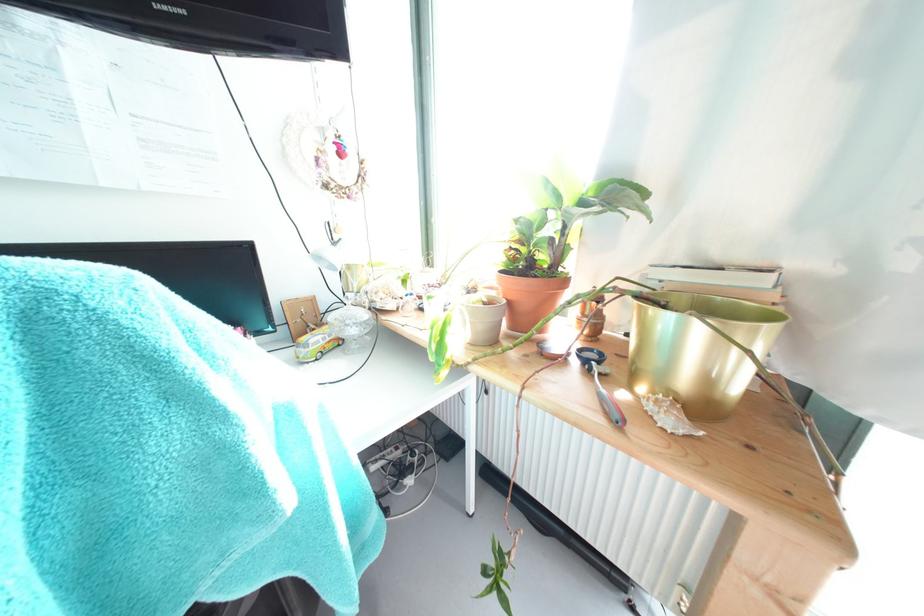
Where would you grasp the blue scissors handle? Please return your answer as a coordinate pair (x, y).

(611, 407)